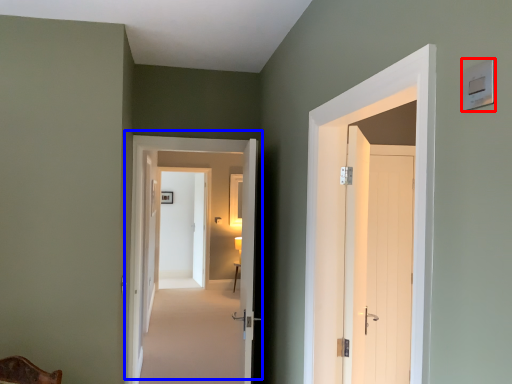
Question: Among these objects, which one is nearest to the camera, light switch (highlighted by a red box) or door (highlighted by a blue box)?

Choices:
 (A) light switch
 (B) door

Answer: (A)